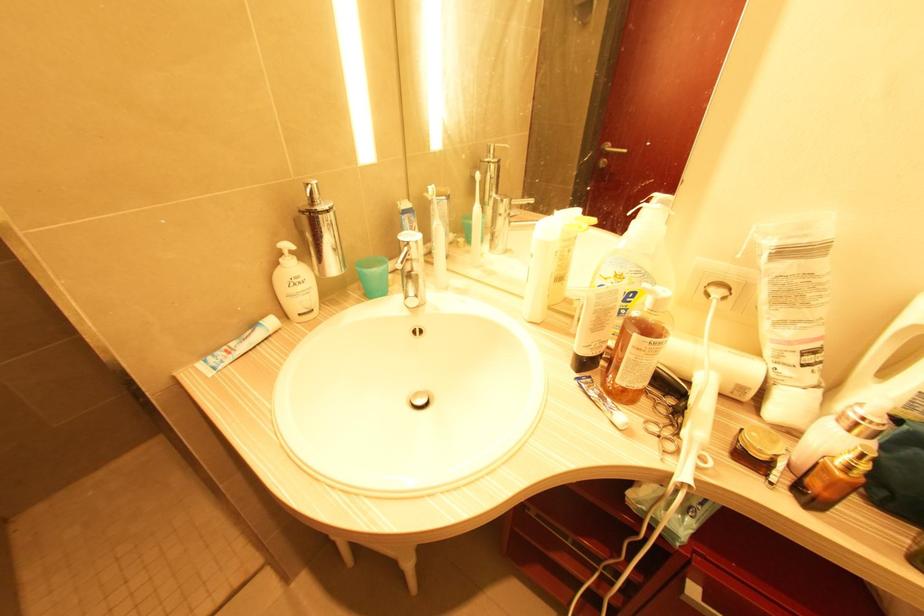
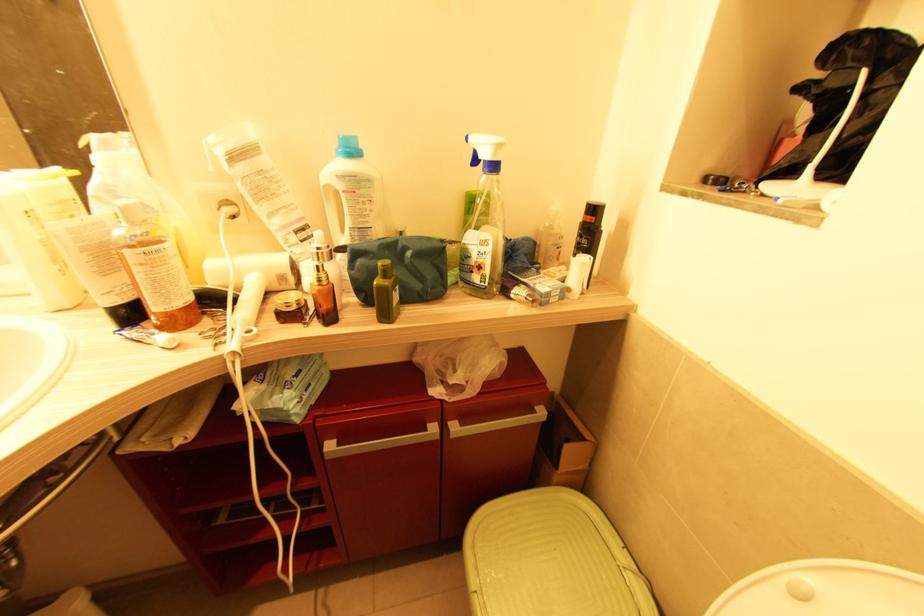
In the second image, find the point that corresponds to the point at 743,390 in the first image.

(284, 278)